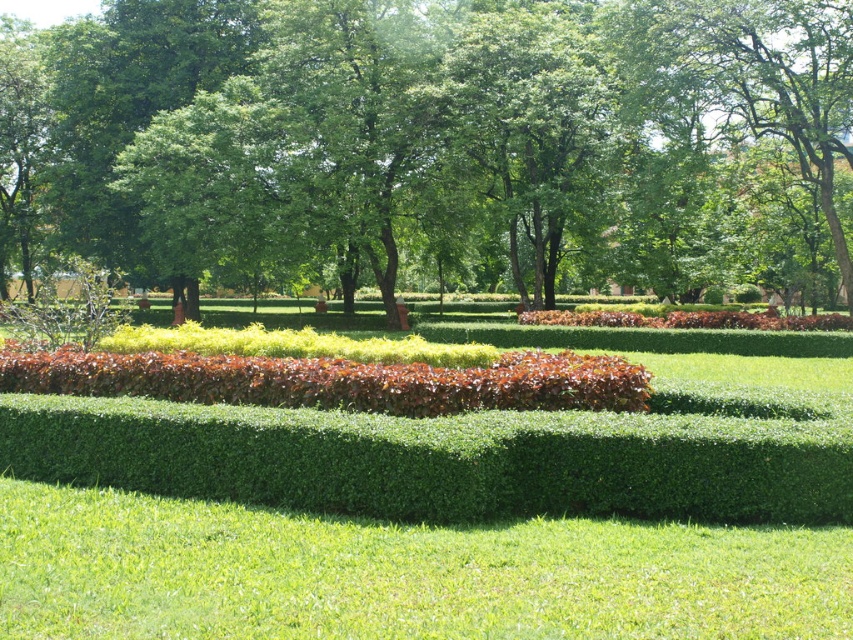
You are a gardener who wants to plant a new tree in the park. You have a small sapling that needs space. Based on the image, is there enough space between the green leafy tree at center and the green leafy grass at center to plant the sapling?

The green leafy tree at center is bigger than the green leafy grass at center, but the description does not provide specific spatial measurements between them. Therefore, it is unclear if there is enough space to plant the sapling between them.

You are a gardener planning to plant a new flower bed in the park. You notice the green leafy tree at center and the green smooth grass at center. Which object is located above the other?

The green leafy tree at center is positioned over green smooth grass at center, so the tree is above the grass.

You are planning to place a picnic blanket in the park. You see the green leafy tree at center and the green smooth grass at center. Which area would provide more space for the blanket if the tree is wider than the grass?

The green leafy tree at center might be wider than the green smooth grass at center, so the area around the green smooth grass at center would likely have more space for the picnic blanket.